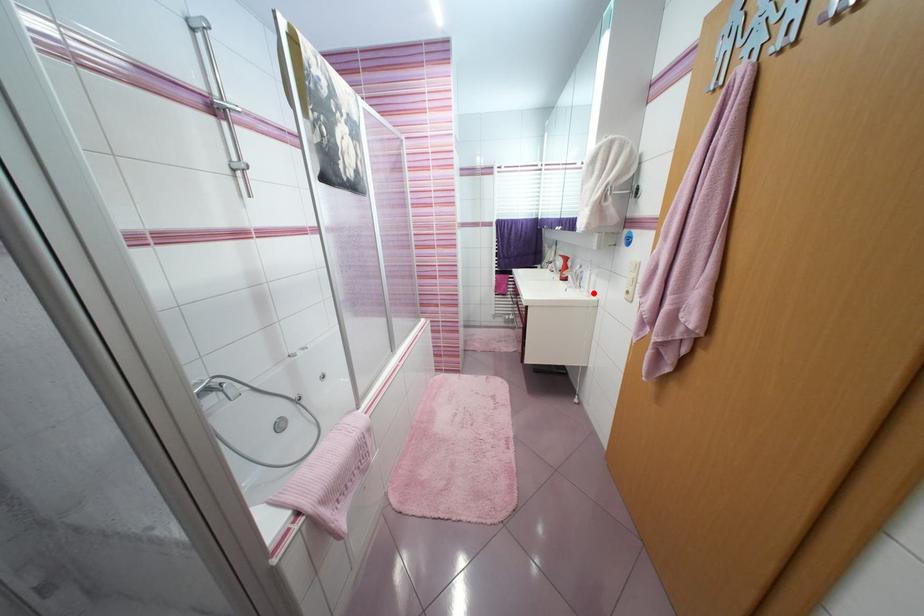
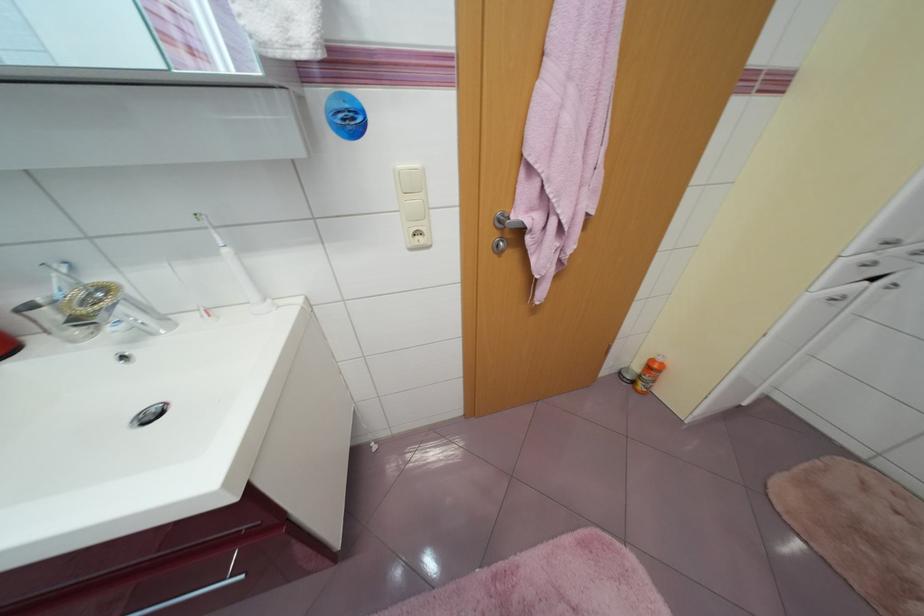
The point at the highlighted location is marked in the first image. Where is the corresponding point in the second image?

(270, 302)